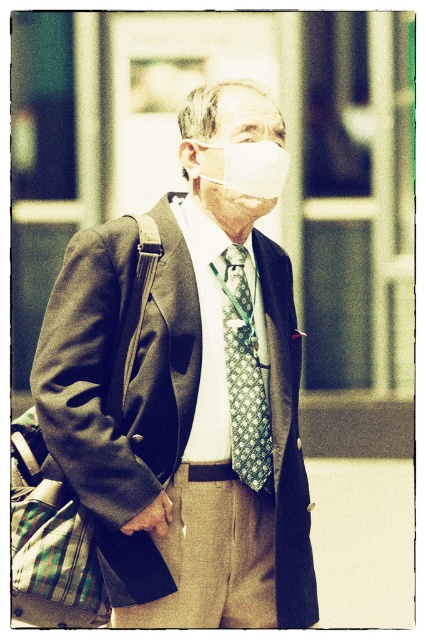
Question: Is matte black suit at center further to camera compared to green patterned tie at center?

Choices:
 (A) no
 (B) yes

Answer: (A)

Question: Based on their relative distances, which object is nearer to the white matte mask at center?

Choices:
 (A) matte black suit at center
 (B) green patterned tie at center

Answer: (A)

Question: Which of the following is the closest to the observer?

Choices:
 (A) (235, 353)
 (B) (207, 92)

Answer: (A)

Question: Considering the real-world distances, which object is farthest from the green patterned tie at center?

Choices:
 (A) matte black suit at center
 (B) white matte mask at center

Answer: (B)

Question: Is matte black suit at center behind green patterned tie at center?

Choices:
 (A) no
 (B) yes

Answer: (A)

Question: Can you confirm if matte black suit at center is smaller than white matte mask at center?

Choices:
 (A) yes
 (B) no

Answer: (B)